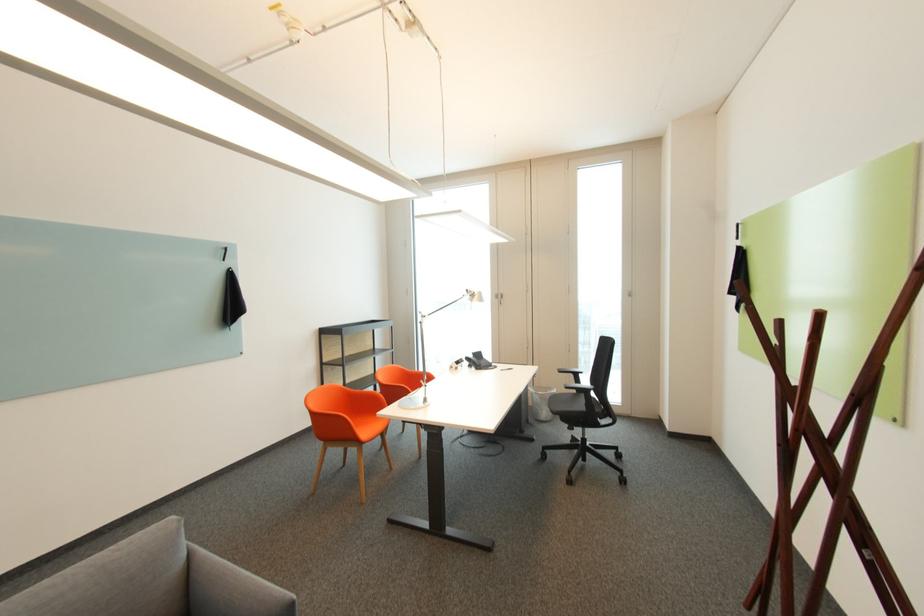
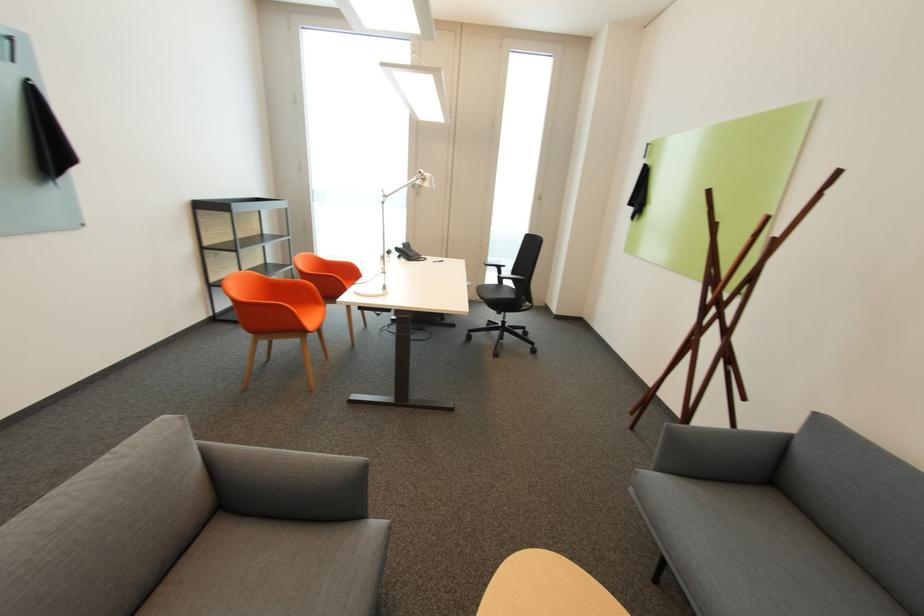
The point at (274, 589) is marked in the first image. Where is the corresponding point in the second image?

(339, 458)